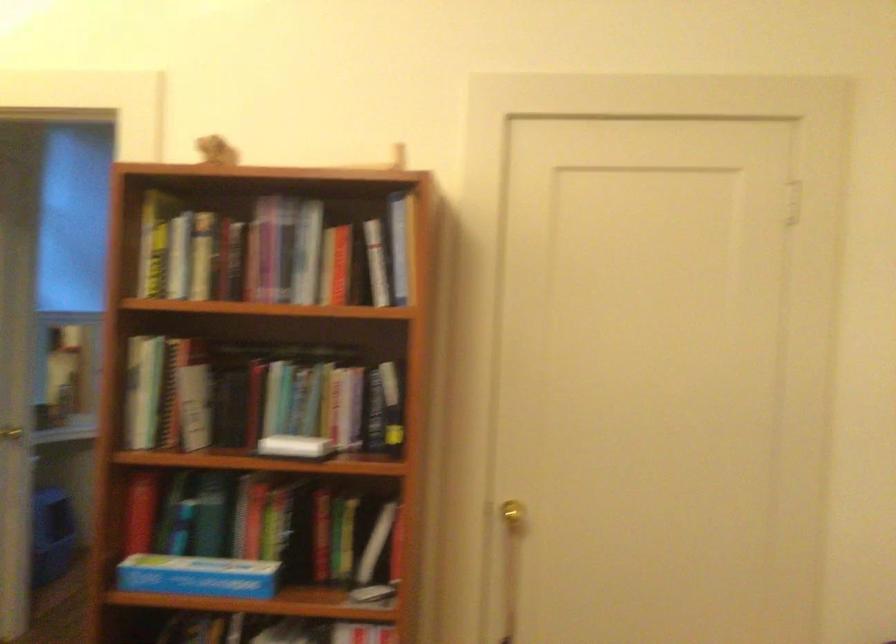
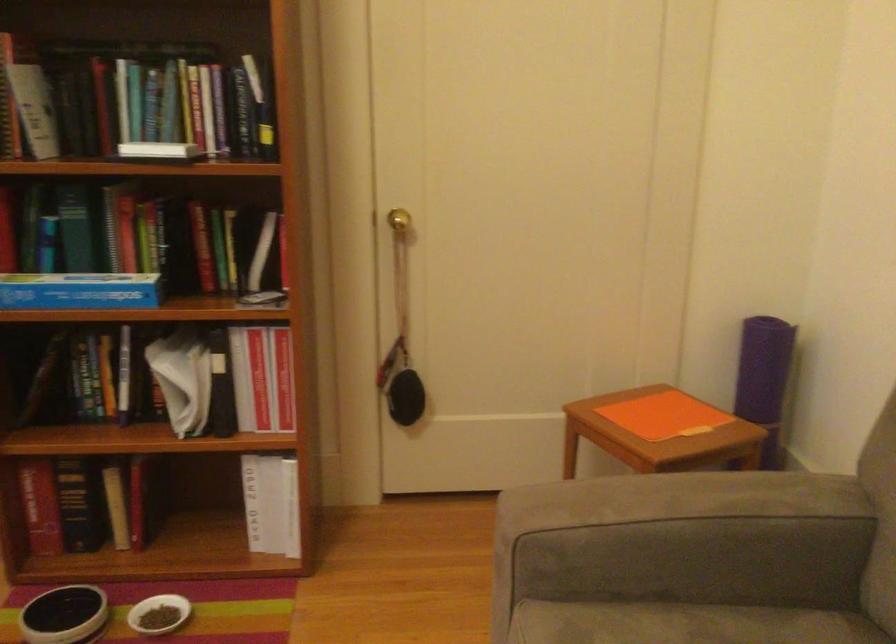
Question: The images are taken continuously from a first-person perspective. In which direction is your viewpoint rotating?

Choices:
 (A) Left
 (B) Right
 (C) Up
 (D) Down

Answer: (D)